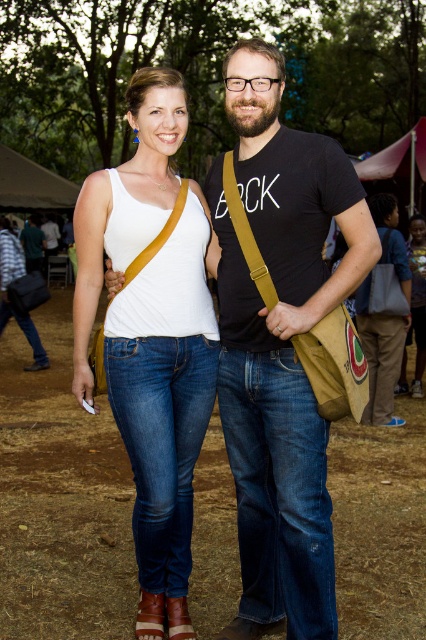
This screenshot has height=640, width=426. What do you see at coordinates (279, 346) in the screenshot? I see `black cotton t-shirt at center` at bounding box center [279, 346].

Can you confirm if black cotton t-shirt at center is smaller than white matte tank top at center?

Incorrect, black cotton t-shirt at center is not smaller in size than white matte tank top at center.

What are the coordinates of `black cotton t-shirt at center` in the screenshot? It's located at (279, 346).

Image resolution: width=426 pixels, height=640 pixels. I want to click on black cotton t-shirt at center, so click(279, 346).